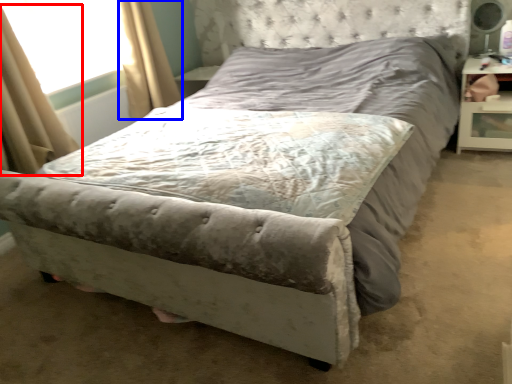
Question: Which of the following is the farthest to the observer, curtain (highlighted by a red box) or curtain (highlighted by a blue box)?

Choices:
 (A) curtain
 (B) curtain

Answer: (B)